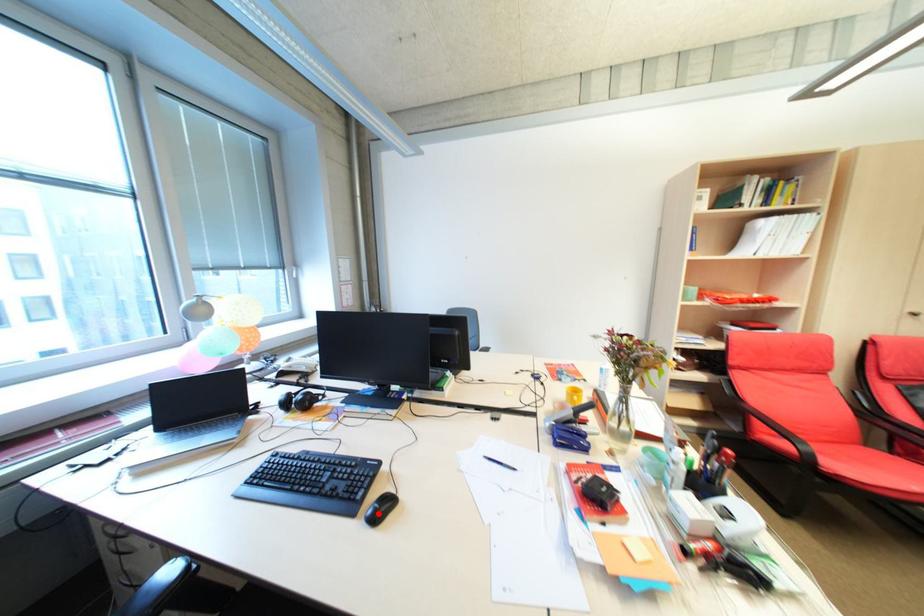
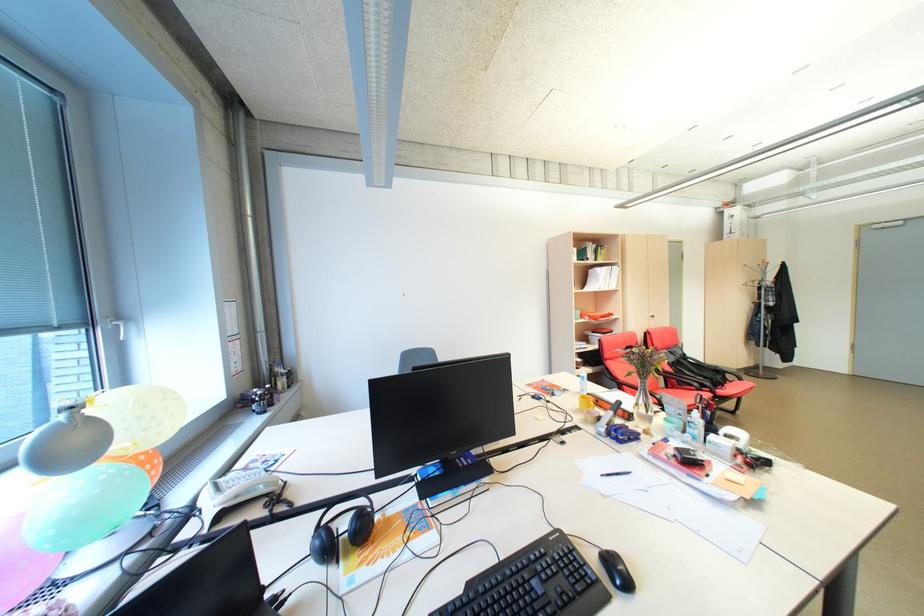
Where in the second image is the point corresponding to the highlighted location from the first image?

(627, 582)